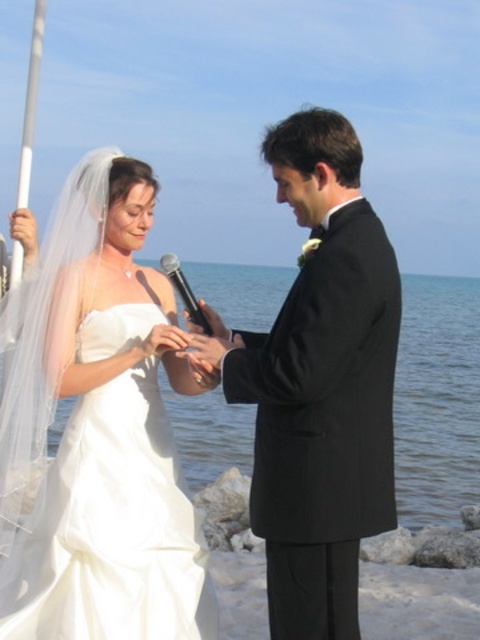
Question: Which point is closer to the camera?

Choices:
 (A) (309, 352)
 (B) (217, 324)

Answer: (A)

Question: Is the position of black metallic microphone at center more distant than that of black matte microphone at center?

Choices:
 (A) no
 (B) yes

Answer: (B)

Question: Which of the following is the farthest from the observer?

Choices:
 (A) black satin suit at center
 (B) black matte microphone at center
 (C) white satin dress at center

Answer: (B)

Question: Which of the following is the farthest from the observer?

Choices:
 (A) black metallic microphone at center
 (B) white satin dress at center

Answer: (A)

Question: Considering the relative positions of black metallic microphone at center and black matte microphone at center in the image provided, where is black metallic microphone at center located with respect to black matte microphone at center?

Choices:
 (A) left
 (B) right

Answer: (A)

Question: Can you confirm if black satin suit at center is positioned to the left of black matte microphone at center?

Choices:
 (A) no
 (B) yes

Answer: (A)